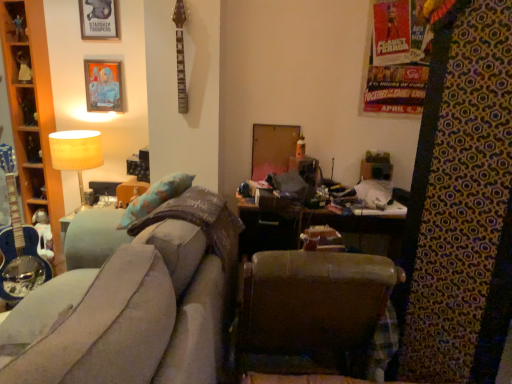
Question: From the image's perspective, does wooden cabinet at left appear higher than metallic silver picture frame at upper left, marked as the 1th picture frame in a bottom-to-top arrangement?

Choices:
 (A) no
 (B) yes

Answer: (A)

Question: Is wooden cabinet at left completely or partially outside of metallic silver picture frame at upper left, marked as the 1th picture frame in a bottom-to-top arrangement?

Choices:
 (A) no
 (B) yes

Answer: (B)

Question: Is wooden cabinet at left far from metallic silver picture frame at upper left, marked as the 1th picture frame in a bottom-to-top arrangement?

Choices:
 (A) no
 (B) yes

Answer: (A)

Question: Does wooden cabinet at left have a lesser height compared to metallic silver picture frame at upper left, marked as the second picture frame in a top-to-bottom arrangement?

Choices:
 (A) yes
 (B) no

Answer: (B)

Question: Can you confirm if wooden cabinet at left is thinner than metallic silver picture frame at upper left, marked as the second picture frame in a top-to-bottom arrangement?

Choices:
 (A) yes
 (B) no

Answer: (B)

Question: Can metallic silver picture frame at upper left, marked as the second picture frame in a top-to-bottom arrangement, be found inside wooden cabinet at left?

Choices:
 (A) no
 (B) yes

Answer: (A)

Question: Does brown leather chair at center lie behind matte beige lampshade at upper left?

Choices:
 (A) no
 (B) yes

Answer: (A)

Question: Is brown leather chair at center completely or partially outside of matte beige lampshade at upper left?

Choices:
 (A) no
 (B) yes

Answer: (B)

Question: Would you say matte beige lampshade at upper left is part of brown leather chair at center's contents?

Choices:
 (A) yes
 (B) no

Answer: (B)

Question: Is brown leather chair at center at the left side of matte beige lampshade at upper left?

Choices:
 (A) yes
 (B) no

Answer: (B)

Question: Considering the relative sizes of brown leather chair at center and matte beige lampshade at upper left in the image provided, is brown leather chair at center wider than matte beige lampshade at upper left?

Choices:
 (A) yes
 (B) no

Answer: (B)

Question: Is brown leather chair at center not near matte beige lampshade at upper left?

Choices:
 (A) yes
 (B) no

Answer: (A)

Question: Would you say metallic silver picture frame at upper left, marked as the 1th picture frame in a bottom-to-top arrangement, is outside brown leather chair at center?

Choices:
 (A) no
 (B) yes

Answer: (B)